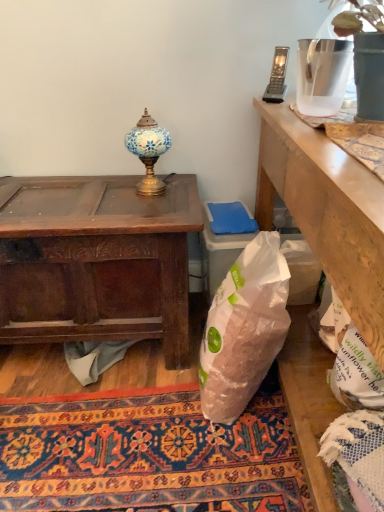
At what (x,y) coordinates should I click in order to perform the action: click on free space between dark brown wood desk at left and gray fabric at lower center. Please return your answer as a coordinate pair (x, y). The width and height of the screenshot is (384, 512). Looking at the image, I should click on (74, 383).